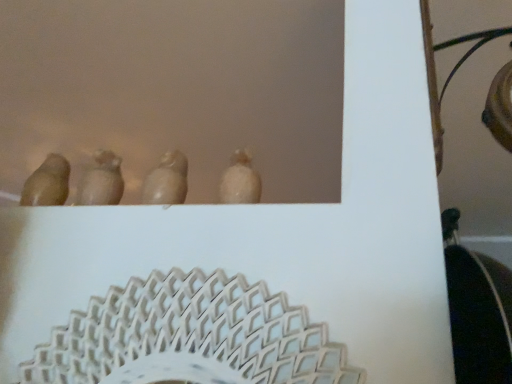
Question: Choose the correct answer: Is matte white bird at center, acting as the 1th animal starting from the right, inside matte brown bird at center, acting as the 1th animal starting from the left, or outside it?

Choices:
 (A) inside
 (B) outside

Answer: (B)

Question: Relative to matte brown bird at center, acting as the 1th animal starting from the left, is matte white bird at center, arranged as the second animal when viewed from the left, in front or behind?

Choices:
 (A) behind
 (B) front

Answer: (B)

Question: Is point (177, 175) closer or farther from the camera than point (112, 153)?

Choices:
 (A) farther
 (B) closer

Answer: (B)

Question: Relative to matte white bird at center, acting as the 1th animal starting from the right, is matte brown bird at center, acting as the 1th animal starting from the left, in front or behind?

Choices:
 (A) behind
 (B) front

Answer: (A)

Question: From the image's perspective, relative to matte white bird at center, arranged as the second animal when viewed from the left, is matte brown bird at center, which is the second animal from right to left, above or below?

Choices:
 (A) above
 (B) below

Answer: (B)

Question: In terms of width, does matte brown bird at center, acting as the 1th animal starting from the left, look wider or thinner when compared to matte white bird at center, arranged as the second animal when viewed from the left?

Choices:
 (A) thin
 (B) wide

Answer: (B)

Question: Would you say matte brown bird at center, acting as the 1th animal starting from the left, is inside or outside matte white bird at center, arranged as the second animal when viewed from the left?

Choices:
 (A) outside
 (B) inside

Answer: (A)